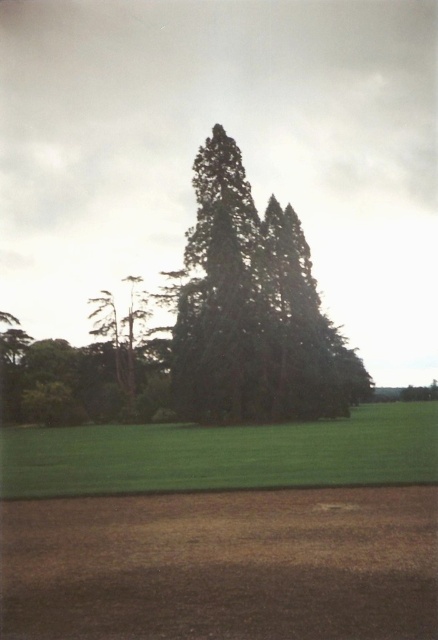
Does brown soil at lower center have a lesser height compared to dark green textured tree at center?

Indeed, brown soil at lower center has a lesser height compared to dark green textured tree at center.

Is point (17, 548) closer to viewer compared to point (216, 397)?

Yes, point (17, 548) is in front of point (216, 397).

Which is behind, point (88, 538) or point (233, 163)?

The point (233, 163) is behind.

Find the location of a particular element. This screenshot has height=640, width=438. brown soil at lower center is located at coordinates (222, 564).

Does brown soil at lower center appear on the left side of green grass at lower center?

Correct, you'll find brown soil at lower center to the left of green grass at lower center.

Who is more forward, (20, 536) or (60, 481)?

Positioned in front is point (20, 536).

Between point (129, 579) and point (126, 483), which one is positioned in front?

Point (129, 579)

At what (x,y) coordinates should I click in order to perform the action: click on brown soil at lower center. Please return your answer as a coordinate pair (x, y). The height and width of the screenshot is (640, 438). Looking at the image, I should click on (222, 564).

Who is higher up, dark green textured tree at center or green grass at lower center?

Positioned higher is dark green textured tree at center.

I want to click on dark green textured tree at center, so click(202, 328).

Locate an element on the screen. dark green textured tree at center is located at coordinates (202, 328).